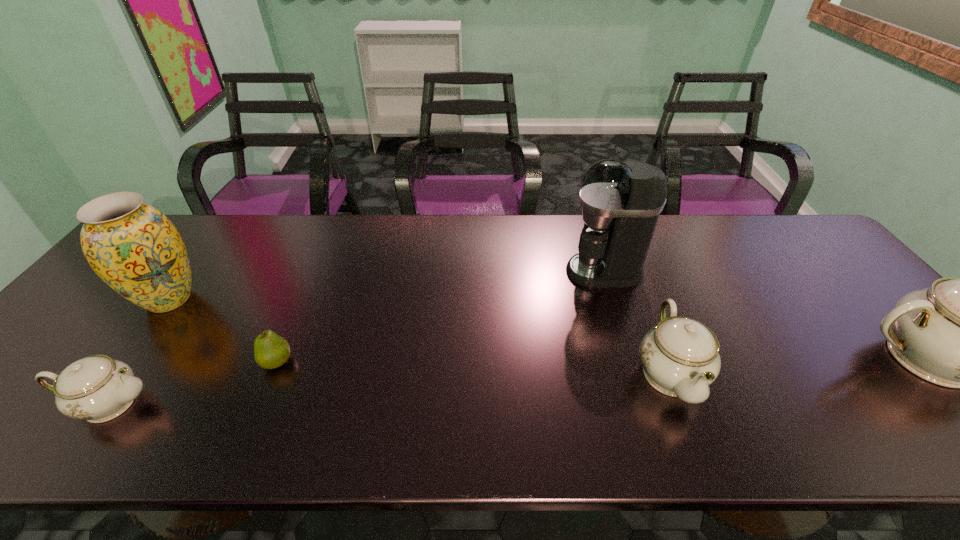
In the image, there is a desktop. What are the coordinates of `free region at the near edge` in the screenshot? It's located at (306, 381).

Find the location of a particular element. blank space at the far right corner is located at coordinates (821, 255).

At what (x,y) coordinates should I click in order to perform the action: click on unoccupied position between the coffee maker and the fourth tallest object. Please return your answer as a coordinate pair (x, y). Looking at the image, I should click on (636, 322).

Identify the location of free space between the third shortest object and the vase. (420, 336).

Locate an element on the screen. This screenshot has height=540, width=960. free space between the coffee maker and the vase is located at coordinates (387, 286).

This screenshot has height=540, width=960. In order to click on free point between the fifth tallest object and the second tallest object in this screenshot , I will do `click(139, 352)`.

Find the location of `free space between the pear and the third shortest object`. free space between the pear and the third shortest object is located at coordinates (473, 367).

Find the location of a particular element. empty space between the coffee maker and the fifth shortest object is located at coordinates (387, 286).

Where is `free space between the fourth tallest object and the fourth object from right to left`? This screenshot has width=960, height=540. free space between the fourth tallest object and the fourth object from right to left is located at coordinates (473, 367).

I want to click on vacant region between the second chinaware from left to right and the second tallest object, so click(x=420, y=336).